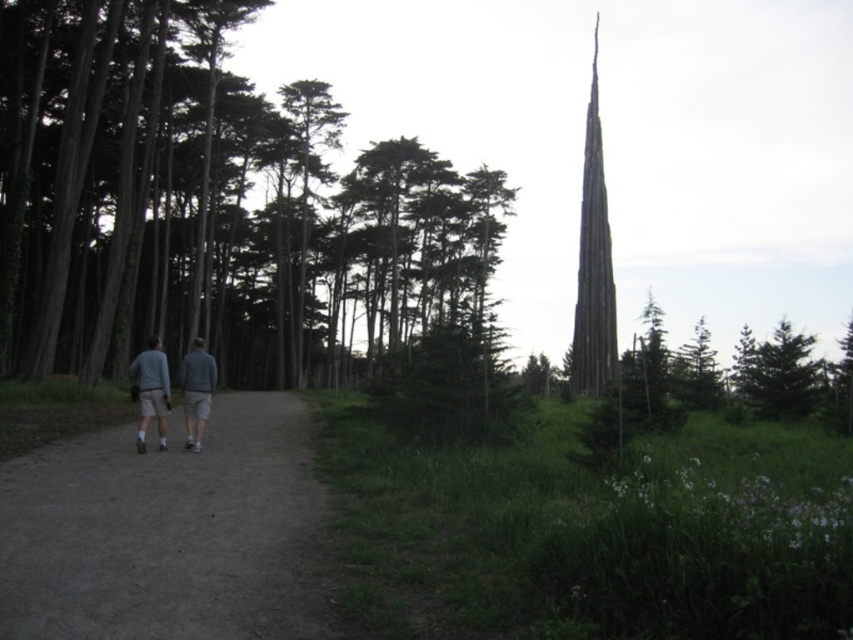
Question: Which object appears closest to the camera in this image?

Choices:
 (A) gray cotton shorts at center
 (B) smooth gray spire at upper right

Answer: (A)

Question: Is smooth bark tree at center to the right of gray fabric shorts at left from the viewer's perspective?

Choices:
 (A) yes
 (B) no

Answer: (B)

Question: Is dirt path at lower center above smooth gray spire at upper right?

Choices:
 (A) yes
 (B) no

Answer: (B)

Question: Is gray cotton shorts at center further to the viewer compared to gray matte shirt at center?

Choices:
 (A) no
 (B) yes

Answer: (A)

Question: Which object is closer to the camera taking this photo?

Choices:
 (A) gray fabric shorts at left
 (B) gray cotton shorts at center
 (C) smooth bark tree at center

Answer: (B)

Question: Which object is farther from the camera taking this photo?

Choices:
 (A) smooth gray spire at upper right
 (B) gray matte shirt at center
 (C) gray fabric shorts at left
 (D) dirt path at lower center

Answer: (A)